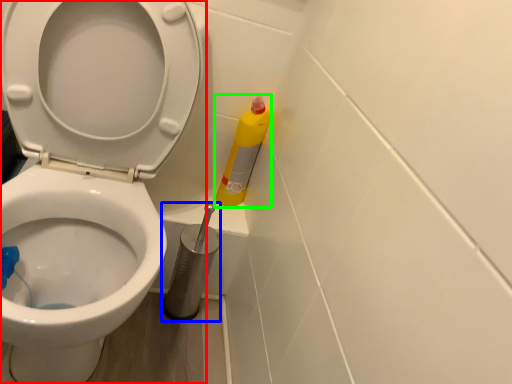
Question: Which is farther away from toilet (highlighted by a red box)? brush (highlighted by a blue box) or cleaning product (highlighted by a green box)?

Choices:
 (A) brush
 (B) cleaning product

Answer: (B)